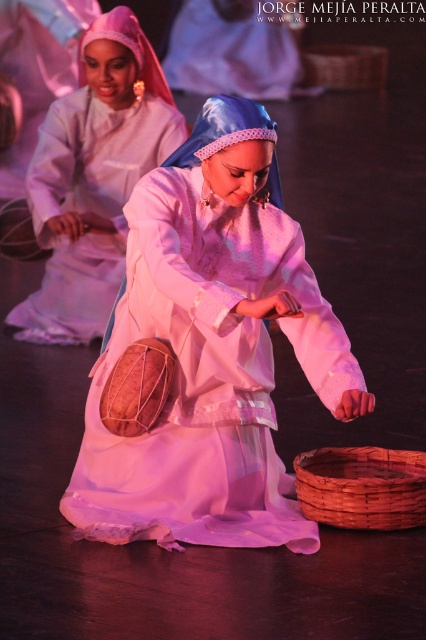
Question: Is matte white fabric at center below woven brown basket at center?

Choices:
 (A) yes
 (B) no

Answer: (A)

Question: Among these objects, which one is farthest from the camera?

Choices:
 (A) matte white fabric at center
 (B) woven brown basket at center
 (C) brown woven basket at lower center
 (D) matte white dress at center

Answer: (B)

Question: Can you confirm if matte white fabric at center is positioned below woven brown basket at center?

Choices:
 (A) no
 (B) yes

Answer: (B)

Question: Does brown woven basket at lower center have a greater width compared to woven brown basket at center?

Choices:
 (A) no
 (B) yes

Answer: (A)

Question: Among these points, which one is farthest from the camera?

Choices:
 (A) (94, 54)
 (B) (221, 452)
 (C) (379, 83)
 (D) (310, 458)

Answer: (C)

Question: Which object is farther from the camera taking this photo?

Choices:
 (A) matte white fabric at center
 (B) matte white dress at center
 (C) woven brown basket at center

Answer: (C)